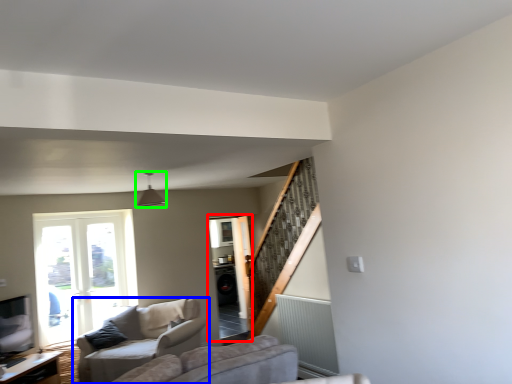
Question: Estimate the real-world distances between objects in this image. Which object is farther from screen door (highlighted by a red box), studio couch (highlighted by a blue box) or light fixture (highlighted by a green box)?

Choices:
 (A) studio couch
 (B) light fixture

Answer: (B)